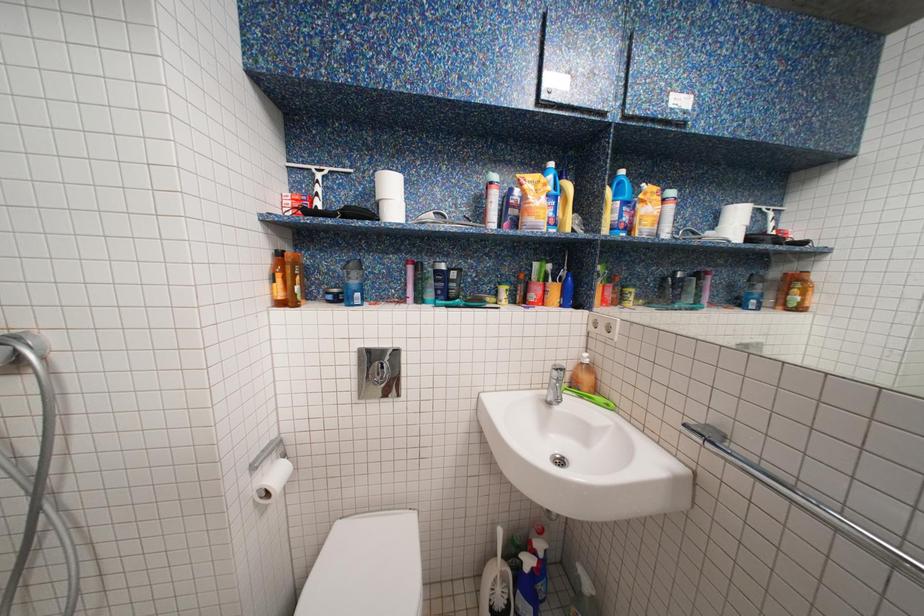
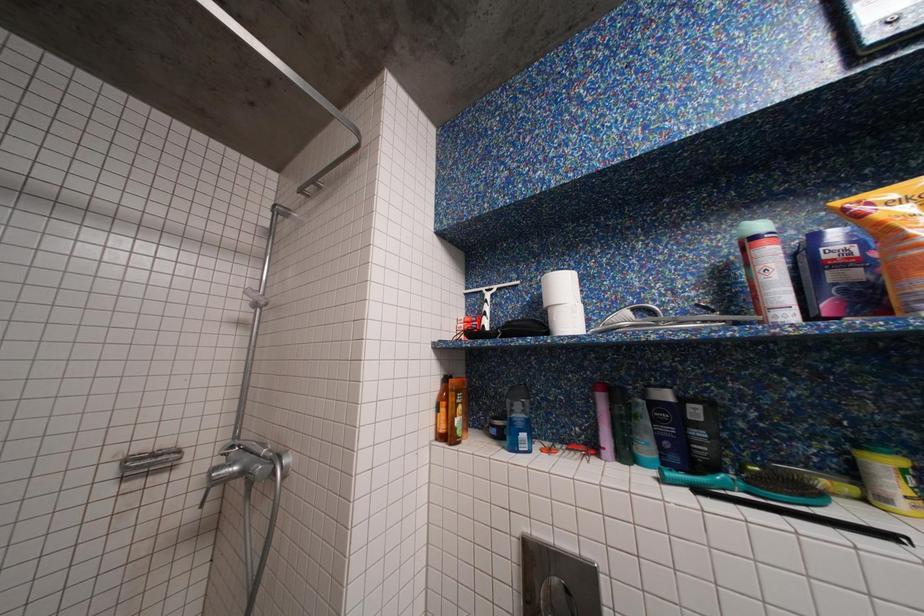
First-person continuous shooting, in which direction is the camera rotating?

The rotation direction of the camera is left-up.